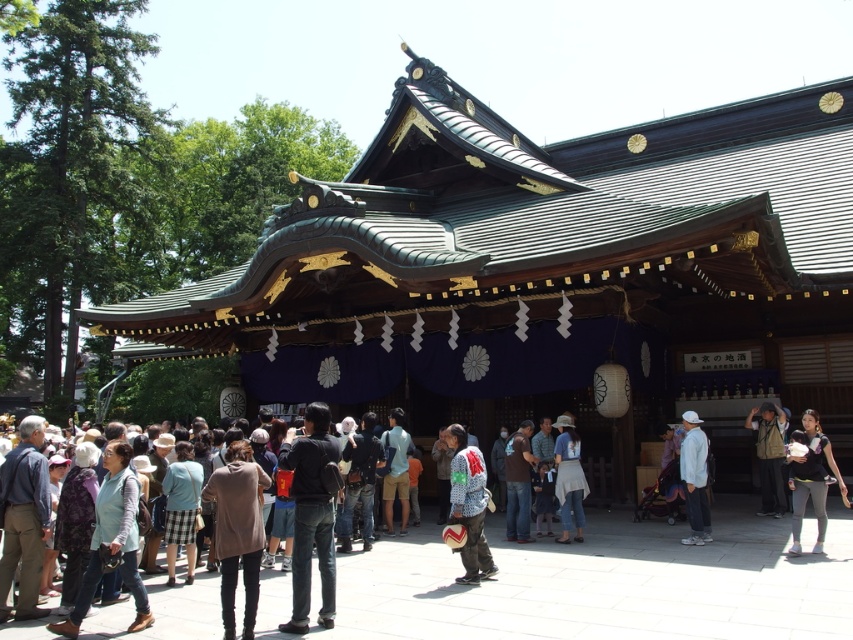
You are a photographer standing in front of the shrine. You notice a denim jacket at center and a light blue fabric backpack at center. Which item do you need to adjust your camera focus on first if you want to capture both items clearly in the same frame?

The denim jacket at center has a larger width than the light blue fabric backpack at center, so you should focus on the denim jacket at center first to ensure it fits within the frame properly before adjusting for the smaller backpack.

You are standing in front of the shrine and notice a denim jacket at center and a light blue fabric backpack at center. Which item is positioned to the right of the other?

The denim jacket at center is to the right of the light blue fabric backpack at center.